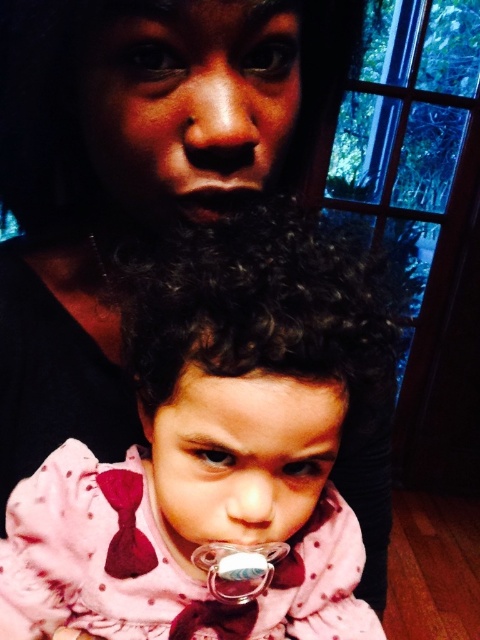
Looking at this image, you are a photographer setting up for a photoshoot in this room. You have a pink fabric pacifier at center and a clear plastic pacifier at center. The distance between them is critical for your setup. Can you fit both pacifiers within a 10 cm wide shelf without overlapping?

The pink fabric pacifier at center is 10.78 centimeters away from the clear plastic pacifier at center. Since the distance between them is greater than 10 cm, they cannot fit within a 10 cm wide shelf without overlapping.

You are a photographer adjusting the lighting in the room to ensure the clear plastic pacifier at center and dry matte lips at center are both well lit. Given the distance between them, what adjustment should you make to the lighting to evenly illuminate both objects?

The clear plastic pacifier at center is 9.72 inches from dry matte lips at center. To evenly illuminate both, adjust the lighting to cover a radius slightly larger than 9.72 inches so both objects are within the same light intensity area.

You are an interior designer analyzing the placement of objects in this room. The pink fabric pacifier at center is located at coordinates 0.702, 0.440 in the image. If you want to place a decorative item exactly 0.1 units to the right of the pacifier, what coordinates should you use?

To place the decorative item 0.1 units to the right of the pink fabric pacifier at center, you should use coordinates (211, 513).